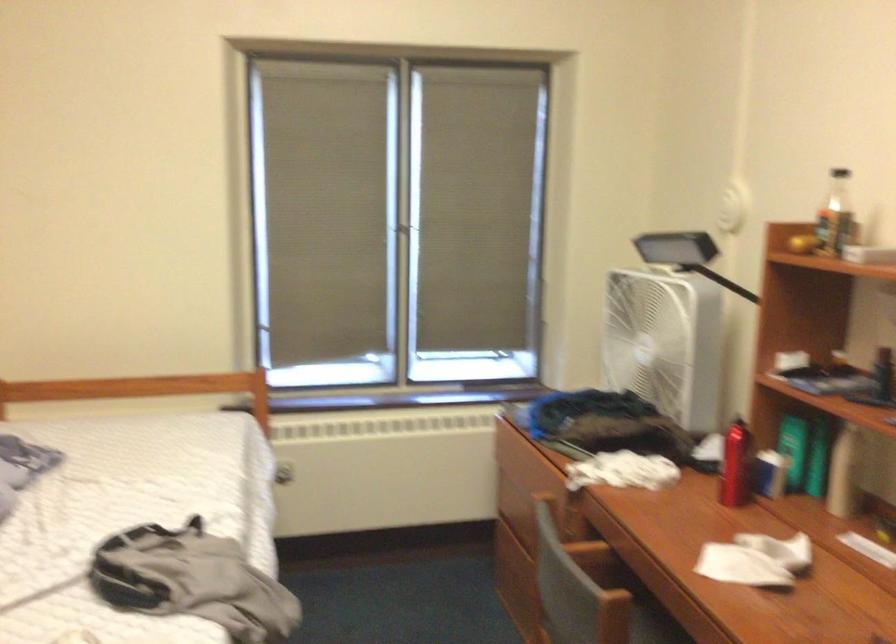
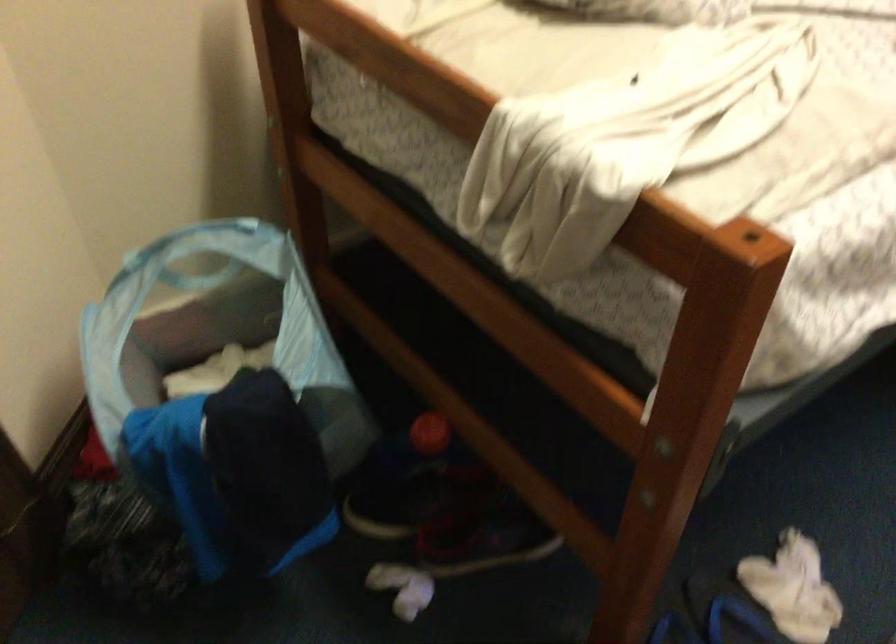
The first image is from the beginning of the video and the second image is from the end. How did the camera likely rotate when shooting the video?

The camera's rotation is toward left-down.